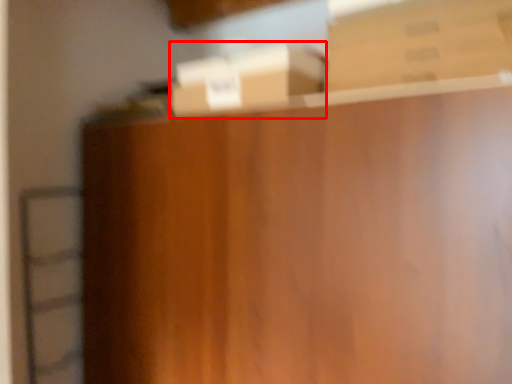
Question: Observing the image, what is the correct spatial positioning of box (annotated by the red box) in reference to box?

Choices:
 (A) left
 (B) right

Answer: (A)